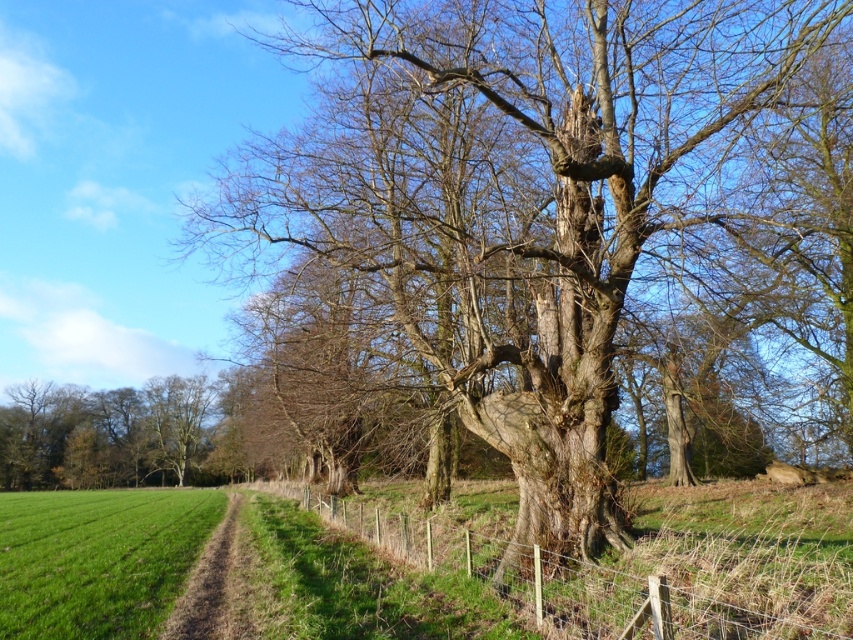
Question: Is smooth bark tree at center above smooth brown tree at lower left?

Choices:
 (A) yes
 (B) no

Answer: (A)

Question: Which object is farther from the camera taking this photo?

Choices:
 (A) brown dirt path at lower left
 (B) smooth brown tree at lower left

Answer: (B)

Question: In this image, where is green grass at lower left located relative to smooth brown tree at lower left?

Choices:
 (A) right
 (B) left

Answer: (A)

Question: Does wooden wire at center have a lesser width compared to brown dirt path at lower left?

Choices:
 (A) yes
 (B) no

Answer: (B)

Question: Which of the following is the farthest from the observer?

Choices:
 (A) brown dirt path at lower left
 (B) wooden wire at center

Answer: (A)

Question: Which point is closer to the camera?

Choices:
 (A) brown dirt path at lower left
 (B) wooden wire at center
 (C) smooth bark tree at center
 (D) smooth brown tree at lower left

Answer: (B)